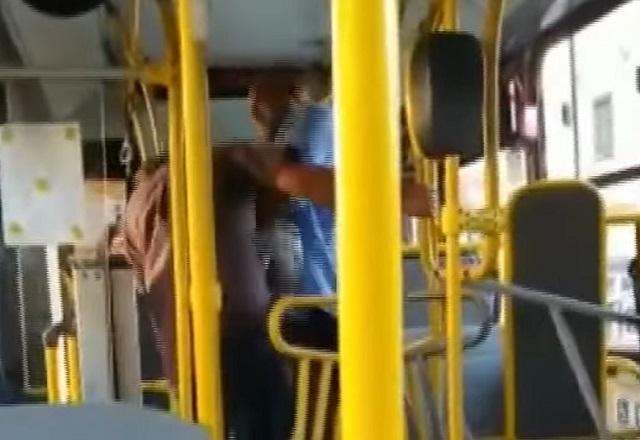
Where is `handle`? This screenshot has height=440, width=640. handle is located at coordinates (304, 354).